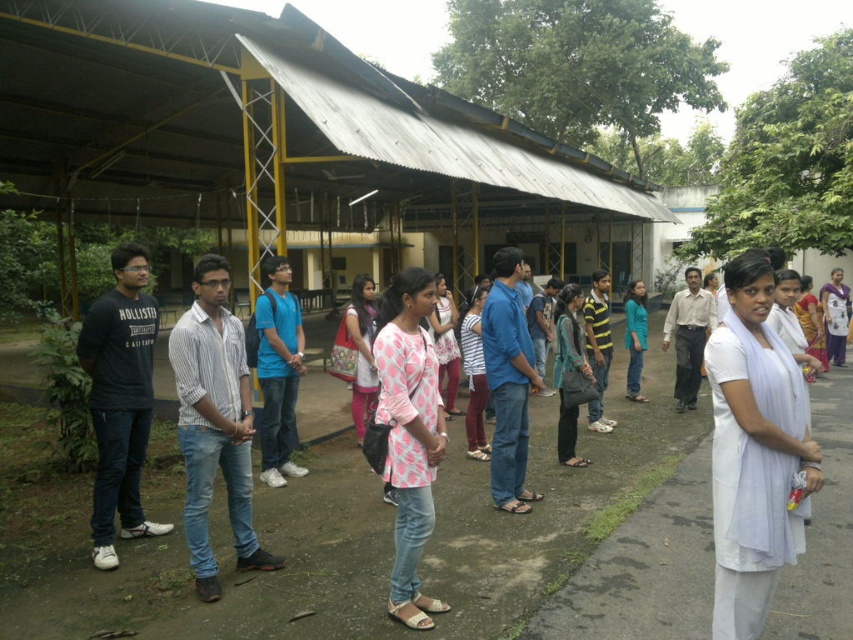
Which is in front, point (741, 602) or point (494, 499)?

Point (741, 602)

Between white cotton kurta at center and blue jeans at center, which one is positioned lower?

white cotton kurta at center is below.

Who is more distant from viewer, (764, 305) or (514, 465)?

The point (514, 465) is behind.

Find the location of `white cotton kurta at center`. white cotton kurta at center is located at coordinates (753, 451).

Is point (785, 348) closer to viewer compared to point (640, 289)?

That is True.

Who is more distant from viewer, [744,445] or [639,371]?

The point [639,371] is more distant.

Locate an element on the screen. white cotton kurta at center is located at coordinates (753, 451).

Measure the distance from denim jeans at center to dotted fabric dress at center.

denim jeans at center is 7.18 feet away from dotted fabric dress at center.

The height and width of the screenshot is (640, 853). Describe the element at coordinates (570, 372) in the screenshot. I see `denim jeans at center` at that location.

Which is behind, point (560, 460) or point (366, 276)?

The point (366, 276) is behind.

The height and width of the screenshot is (640, 853). I want to click on denim jeans at center, so click(x=570, y=372).